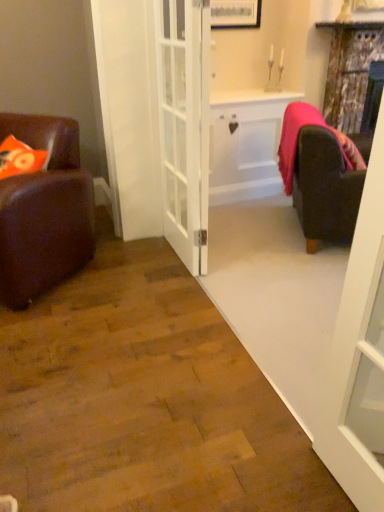
Image resolution: width=384 pixels, height=512 pixels. Describe the element at coordinates (44, 211) in the screenshot. I see `brown leather chair at left` at that location.

This screenshot has height=512, width=384. Describe the element at coordinates (359, 354) in the screenshot. I see `white glass door at right, the 2th door from the left` at that location.

Image resolution: width=384 pixels, height=512 pixels. What do you see at coordinates (350, 71) in the screenshot? I see `distressed wood curtain at upper right` at bounding box center [350, 71].

Identify the location of white matte cabinet at center. Image resolution: width=384 pixels, height=512 pixels. (245, 144).

Considering the relative sizes of white glass door at right, the 1th door from the front, and brown leather chair at left in the image provided, is white glass door at right, the 1th door from the front, shorter than brown leather chair at left?

Incorrect, the height of white glass door at right, the 1th door from the front, does not fall short of that of brown leather chair at left.

Identify the location of chair that appears on the left of white glass door at right, the 2th door from the left. Image resolution: width=384 pixels, height=512 pixels. (44, 211).

From a real-world perspective, is white glass door at right, the second door when ordered from back to front, located beneath brown leather chair at left?

Actually, white glass door at right, the second door when ordered from back to front, is physically above brown leather chair at left in the real world.

From the image's perspective, does white glass door at right, the 1th door from the front, appear lower than brown leather chair at left?

Yes, from the image's perspective, white glass door at right, the 1th door from the front, is beneath brown leather chair at left.

Is brown leather chair at left at the right side of velvet dark brown armchair at right?

In fact, brown leather chair at left is to the left of velvet dark brown armchair at right.

From a real-world perspective, who is located lower, brown leather chair at left or velvet dark brown armchair at right?

brown leather chair at left, from a real-world perspective.

Does brown leather chair at left come behind velvet dark brown armchair at right?

No, it is in front of velvet dark brown armchair at right.

Is brown leather chair at left not near velvet dark brown armchair at right?

Absolutely, brown leather chair at left is distant from velvet dark brown armchair at right.

Is the position of white matte cabinet at center more distant than that of velvet dark brown armchair at right?

Yes, white matte cabinet at center is behind velvet dark brown armchair at right.

Image resolution: width=384 pixels, height=512 pixels. I want to click on studio couch on the right side of white matte cabinet at center, so click(322, 174).

Considering the relative sizes of white matte cabinet at center and velvet dark brown armchair at right in the image provided, is white matte cabinet at center wider than velvet dark brown armchair at right?

No, white matte cabinet at center is not wider than velvet dark brown armchair at right.

Which object is closer to the camera taking this photo, velvet dark brown armchair at right or distressed wood curtain at upper right?

velvet dark brown armchair at right is in front.

Considering the positions of point (331, 166) and point (345, 23), is point (331, 166) closer or farther from the camera than point (345, 23)?

Point (331, 166) is closer to the camera than point (345, 23).

Can you confirm if velvet dark brown armchair at right is bigger than distressed wood curtain at upper right?

Correct, velvet dark brown armchair at right is larger in size than distressed wood curtain at upper right.

From the image's perspective, is velvet dark brown armchair at right on distressed wood curtain at upper right?

Actually, velvet dark brown armchair at right appears below distressed wood curtain at upper right in the image.

In the scene shown: How far apart are brown leather chair at left and white glass door at right, which ranks as the 1th door in right-to-left order?

brown leather chair at left and white glass door at right, which ranks as the 1th door in right-to-left order, are 5.41 feet apart from each other.

Which point is more forward, (58,207) or (340,416)?

Point (340,416)

Consider the image. From a real-world perspective, is brown leather chair at left physically located above or below white glass door at right, the 1th door from the front?

Clearly, from a real-world perspective, brown leather chair at left is below white glass door at right, the 1th door from the front.

Is brown leather chair at left located outside white glass door at right, which ranks as the 1th door in right-to-left order?

Yes, brown leather chair at left is outside of white glass door at right, which ranks as the 1th door in right-to-left order.

Considering the sizes of white glass door at right, which ranks as the 1th door in right-to-left order, and distressed wood curtain at upper right in the image, is white glass door at right, which ranks as the 1th door in right-to-left order, taller or shorter than distressed wood curtain at upper right?

In the image, white glass door at right, which ranks as the 1th door in right-to-left order, appears to be taller than distressed wood curtain at upper right.

How distant is white glass door at right, the 2th door from the left, from distressed wood curtain at upper right?

white glass door at right, the 2th door from the left, is 2.51 meters from distressed wood curtain at upper right.

Is white glass door at right, which ranks as the 1th door in right-to-left order, directly adjacent to distressed wood curtain at upper right?

No, white glass door at right, which ranks as the 1th door in right-to-left order, is not with distressed wood curtain at upper right.

Is white glass door at right, the second door when ordered from back to front, wider or thinner than distressed wood curtain at upper right?

Considering their sizes, white glass door at right, the second door when ordered from back to front, looks slimmer than distressed wood curtain at upper right.

Image resolution: width=384 pixels, height=512 pixels. I want to click on chair in front of the white matte cabinet at center, so click(44, 211).

Is brown leather chair at left positioned beyond the bounds of white matte cabinet at center?

brown leather chair at left lies outside white matte cabinet at center's area.

Consider the image. Is white matte cabinet at center at the back of brown leather chair at left?

Yes.

Is brown leather chair at left behind white matte cabinet at center?

No, it is not.

From a real-world perspective, count 1st doors upward from the brown leather chair at left and point to it. Please provide its 2D coordinates.

[(359, 354)]

Image resolution: width=384 pixels, height=512 pixels. What are the coordinates of `chair that is below the velvet dark brown armchair at right (from the image's perspective)` in the screenshot? It's located at (44, 211).

From the image, which object appears to be farther from white glass door at center, which is counted as the first door, starting from the left, white glass door at right, which ranks as the 1th door in right-to-left order, or white matte cabinet at center?

white glass door at right, which ranks as the 1th door in right-to-left order, lies further to white glass door at center, which is counted as the first door, starting from the left, than the other object.

Which object lies further to the anchor point white glass door at right, the 2th door from the left, distressed wood curtain at upper right or brown leather chair at left?

distressed wood curtain at upper right is positioned further to the anchor white glass door at right, the 2th door from the left.

When comparing their distances from velvet dark brown armchair at right, does distressed wood curtain at upper right or brown leather chair at left seem further?

brown leather chair at left.

Which object lies further to the anchor point white matte cabinet at center, distressed wood curtain at upper right or white glass door at right, the 1th door from the front?

The object further to white matte cabinet at center is white glass door at right, the 1th door from the front.

Considering their positions, is white glass door at center, the second door in the front-to-back sequence, positioned further to velvet dark brown armchair at right than distressed wood curtain at upper right?

Among the two, distressed wood curtain at upper right is located further to velvet dark brown armchair at right.

From the image, which object appears to be farther from white glass door at right, the second door when ordered from back to front, brown leather chair at left or white glass door at center, which is counted as the first door, starting from the left?

Based on the image, brown leather chair at left appears to be further to white glass door at right, the second door when ordered from back to front.

In the scene shown: Looking at the image, which one is located closer to white glass door at center, which is counted as the first door, starting from the left, velvet dark brown armchair at right or brown leather chair at left?

The object closer to white glass door at center, which is counted as the first door, starting from the left, is brown leather chair at left.

Which object lies further to the anchor point white glass door at center, which is counted as the first door, starting from the left, white glass door at right, the 2th door from the left, or velvet dark brown armchair at right?

white glass door at right, the 2th door from the left.

Find the location of a particular element. The width and height of the screenshot is (384, 512). cabinetry between brown leather chair at left and velvet dark brown armchair at right in the horizontal direction is located at coordinates (245, 144).

The height and width of the screenshot is (512, 384). I want to click on curtain positioned between velvet dark brown armchair at right and white matte cabinet at center from near to far, so click(x=350, y=71).

Locate an element on the screen. door located between white glass door at right, which ranks as the 1th door in right-to-left order, and distressed wood curtain at upper right in the depth direction is located at coordinates (184, 125).

Find the location of a particular element. The height and width of the screenshot is (512, 384). studio couch located between white glass door at right, the 1th door from the front, and distressed wood curtain at upper right in the depth direction is located at coordinates (322, 174).